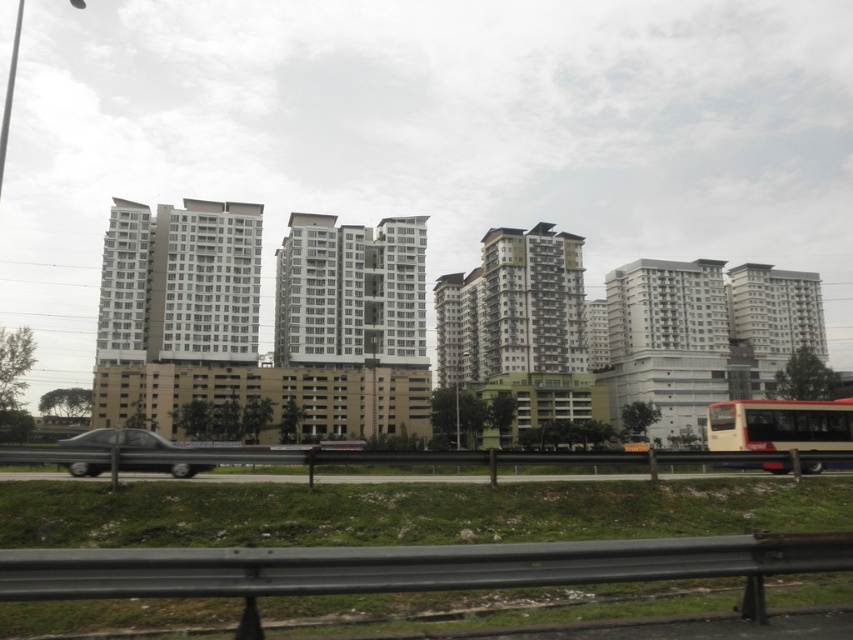
Question: Which point appears farthest from the camera in this image?

Choices:
 (A) coord(791,444)
 (B) coord(146,465)

Answer: (A)

Question: Does yellow matte bus at lower right come in front of metallic silver car at lower left?

Choices:
 (A) no
 (B) yes

Answer: (A)

Question: Among these objects, which one is nearest to the camera?

Choices:
 (A) yellow matte bus at lower right
 (B) metallic silver car at lower left

Answer: (B)

Question: Which point appears closest to the camera in this image?

Choices:
 (A) (706, 429)
 (B) (97, 464)

Answer: (B)

Question: Can you confirm if yellow matte bus at lower right is smaller than metallic silver car at lower left?

Choices:
 (A) yes
 (B) no

Answer: (A)

Question: Can you confirm if yellow matte bus at lower right is bigger than metallic silver car at lower left?

Choices:
 (A) yes
 (B) no

Answer: (B)